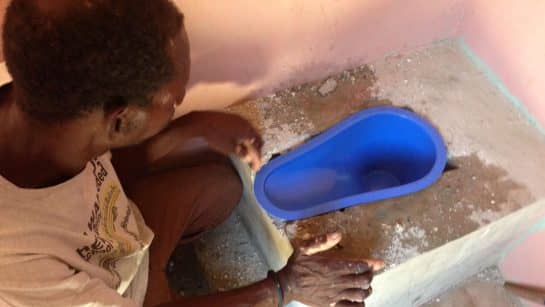
Locate an element on the screen. The width and height of the screenshot is (545, 307). white walls is located at coordinates (337, 26).